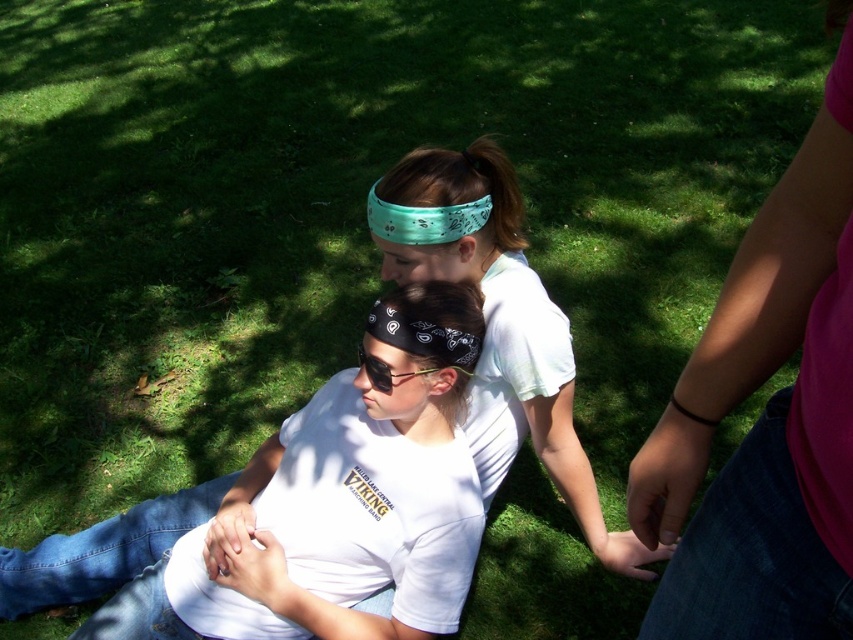
Does pink fabric at upper right have a lesser height compared to black bandana at center?

Incorrect, pink fabric at upper right's height does not fall short of black bandana at center's.

Is point (733, 538) farther from camera compared to point (404, 365)?

No.

Is point (816, 275) positioned before point (393, 348)?

Yes.

Image resolution: width=853 pixels, height=640 pixels. I want to click on pink fabric at upper right, so [767, 417].

Based on the photo, between white cotton t-shirt at center and black reflective sunglasses at center, which one appears on the right side from the viewer's perspective?

From the viewer's perspective, black reflective sunglasses at center appears more on the right side.

Who is higher up, white cotton t-shirt at center or black reflective sunglasses at center?

black reflective sunglasses at center

Does point (396, 332) come closer to viewer compared to point (404, 372)?

Yes, it is in front of point (404, 372).

This screenshot has width=853, height=640. Find the location of `white cotton t-shirt at center`. white cotton t-shirt at center is located at coordinates (335, 506).

Can you confirm if pink fabric at upper right is positioned below green bandana at center?

Correct, pink fabric at upper right is located below green bandana at center.

Which is below, pink fabric at upper right or green bandana at center?

pink fabric at upper right is below.

Is point (834, 412) more distant than point (416, 230)?

No, it is not.

This screenshot has height=640, width=853. In order to click on pink fabric at upper right in this screenshot , I will do `click(767, 417)`.